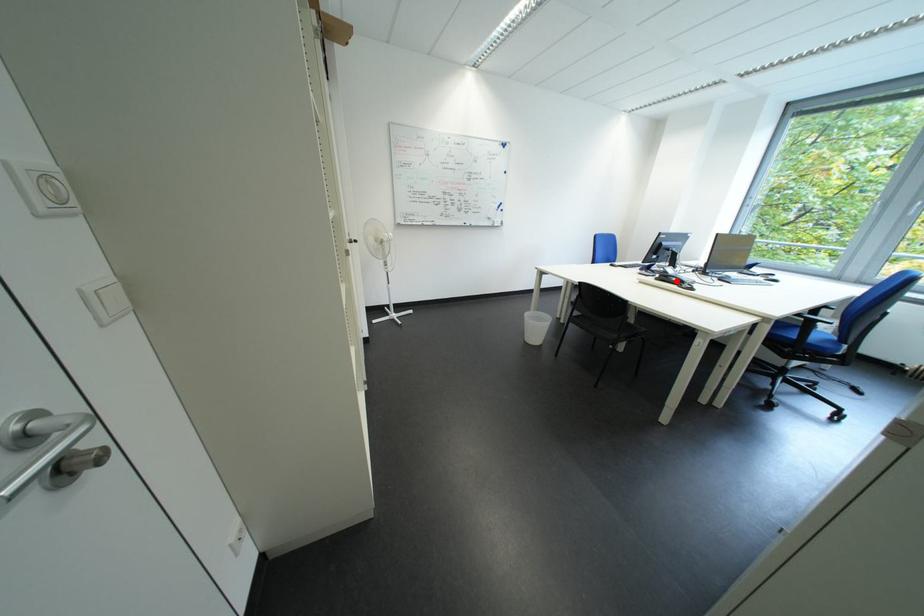
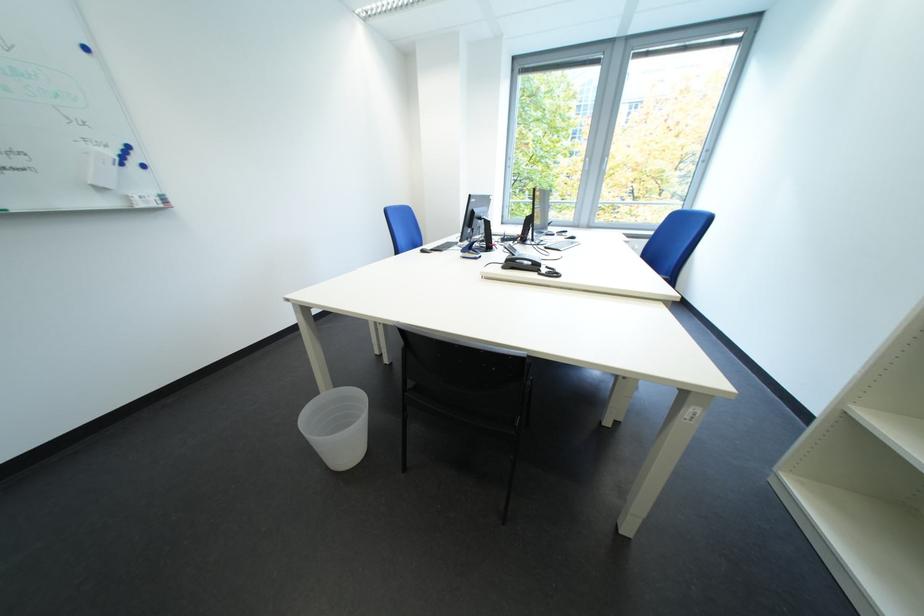
The point at the highlighted location is marked in the first image. Where is the corresponding point in the second image?

(524, 265)